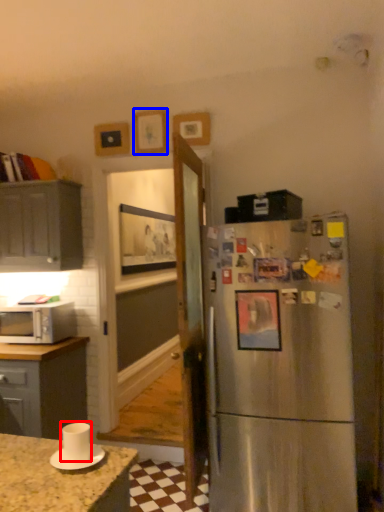
Question: Among these objects, which one is nearest to the camera, appliance (highlighted by a red box) or picture frame (highlighted by a blue box)?

Choices:
 (A) appliance
 (B) picture frame

Answer: (A)